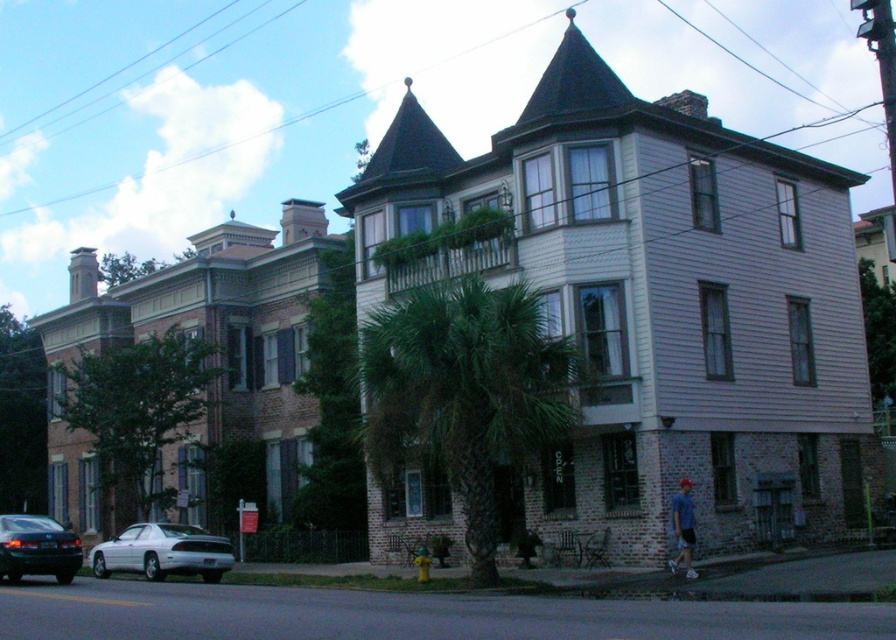
You are a window cleaner standing on the ground floor of the street scene. You need to clean the windows of both the green leafy palm tree at center and the blue cotton shirt at lower right. Which object should you clean first based on their vertical positions?

The blue cotton shirt at lower right should be cleaned first since it is located below the green leafy palm tree at center, which is higher up.

You are a delivery person trying to navigate through the narrow alley between the two buildings. The alley is only as wide as the blue cotton shirt at lower right. Can the green leafy palm tree at center fit through this alley without bending?

The green leafy palm tree at center is thinner than the blue cotton shirt at lower right. Since the alley is as wide as the blue cotton shirt at lower right, the palm tree can fit through the alley without bending because its width is narrower than the alley.

You are standing in the middle of the street looking forward. Which object is positioned to the left of the other between the shiny black sedan at lower left and the blue cotton shirt at lower right?

The shiny black sedan at lower left is positioned to the left of the blue cotton shirt at lower right.